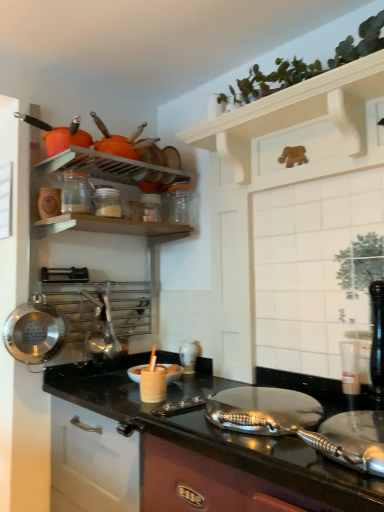
Question: Is white glossy vase at center, marked as the first appliance in a right-to-left arrangement, positioned beyond the bounds of white wooden shelf at upper center?

Choices:
 (A) yes
 (B) no

Answer: (A)

Question: Considering the relative sizes of white glossy vase at center, which ranks as the third appliance in left-to-right order, and white wooden shelf at upper center in the image provided, is white glossy vase at center, which ranks as the third appliance in left-to-right order, bigger than white wooden shelf at upper center?

Choices:
 (A) no
 (B) yes

Answer: (A)

Question: Is white wooden shelf at upper center inside white glossy vase at center, which ranks as the third appliance in left-to-right order?

Choices:
 (A) no
 (B) yes

Answer: (A)

Question: Is white glossy vase at center, which ranks as the third appliance in left-to-right order, directly adjacent to white wooden shelf at upper center?

Choices:
 (A) no
 (B) yes

Answer: (A)

Question: Considering the relative sizes of white glossy vase at center, which ranks as the third appliance in left-to-right order, and white wooden shelf at upper center in the image provided, is white glossy vase at center, which ranks as the third appliance in left-to-right order, thinner than white wooden shelf at upper center?

Choices:
 (A) no
 (B) yes

Answer: (B)

Question: From the image's perspective, relative to clear glass jar at upper center, placed as the 2th appliance when sorted from back to front, is clear glass jar at upper left, arranged as the 3th appliance when viewed from the right, above or below?

Choices:
 (A) above
 (B) below

Answer: (A)

Question: In terms of width, does clear glass jar at upper left, which ranks as the 1th appliance in top-to-bottom order, look wider or thinner when compared to clear glass jar at upper center, which is the 2th appliance in top-to-bottom order?

Choices:
 (A) wide
 (B) thin

Answer: (A)

Question: Is clear glass jar at upper left, marked as the first appliance in a front-to-back arrangement, taller or shorter than clear glass jar at upper center, acting as the 2th appliance starting from the right?

Choices:
 (A) tall
 (B) short

Answer: (A)

Question: Looking at the image, does clear glass jar at upper left, arranged as the 3th appliance when viewed from the right, seem bigger or smaller compared to clear glass jar at upper center, which is the 2th appliance in bottom-to-top order?

Choices:
 (A) big
 (B) small

Answer: (A)

Question: Is point (34, 325) closer or farther from the camera than point (61, 200)?

Choices:
 (A) farther
 (B) closer

Answer: (B)

Question: Considering the relative positions of polished stainless steel wok at left and clear glass jar at upper left, arranged as the 3th appliance when viewed from the right, in the image provided, is polished stainless steel wok at left to the left or to the right of clear glass jar at upper left, arranged as the 3th appliance when viewed from the right,?

Choices:
 (A) right
 (B) left

Answer: (B)

Question: In terms of height, does polished stainless steel wok at left look taller or shorter compared to clear glass jar at upper left, which appears as the third appliance when viewed from the back?

Choices:
 (A) short
 (B) tall

Answer: (B)

Question: Is polished stainless steel wok at left situated inside clear glass jar at upper left, arranged as the 3th appliance when ordered from the bottom, or outside?

Choices:
 (A) outside
 (B) inside

Answer: (A)

Question: Is clear glass jar at upper center, which is the 2th appliance in bottom-to-top order, taller or shorter than polished stainless steel wok at left?

Choices:
 (A) tall
 (B) short

Answer: (B)

Question: Do you think clear glass jar at upper center, placed as the 2th appliance when sorted from back to front, is within polished stainless steel wok at left, or outside of it?

Choices:
 (A) inside
 (B) outside

Answer: (B)